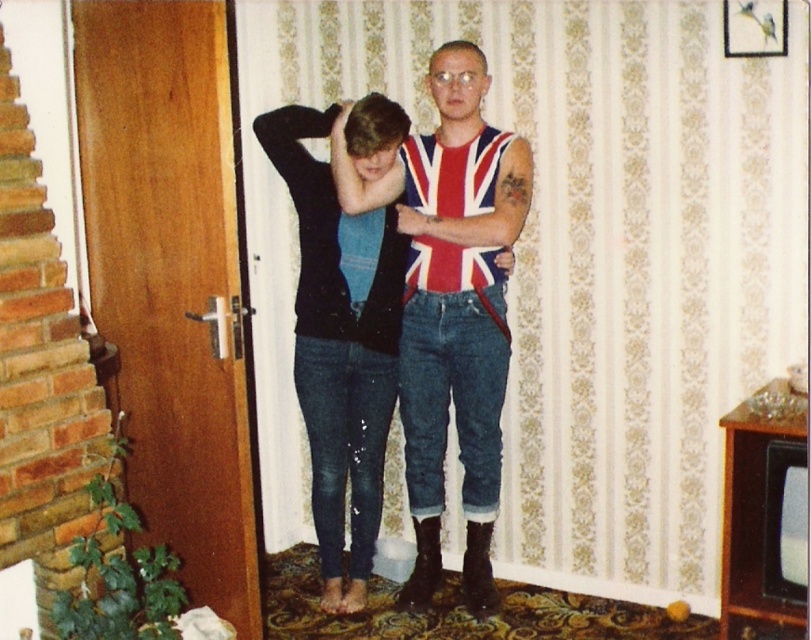
Does point (442, 252) come behind point (413, 524)?

No, (442, 252) is closer to viewer.

Does union jack fabric tank top at center have a lesser width compared to leather at lower center?

Incorrect, union jack fabric tank top at center's width is not less than leather at lower center's.

Measure the distance between point [445,214] and camera.

A distance of 3.02 meters exists between point [445,214] and camera.

Image resolution: width=811 pixels, height=640 pixels. I want to click on union jack fabric tank top at center, so click(x=457, y=316).

Between point (320, 195) and point (402, 604), which one is positioned behind?

The point (402, 604) is more distant.

Between black matte sweater at upper center and leather at lower center, which one is positioned lower?

leather at lower center

Is point (273, 147) farther from viewer compared to point (436, 572)?

No, (273, 147) is in front of (436, 572).

I want to click on black matte sweater at upper center, so click(x=298, y=150).

Is denim jeans at center above union jack fabric at center?

Incorrect, denim jeans at center is not positioned above union jack fabric at center.

Who is higher up, denim jeans at center or union jack fabric at center?

union jack fabric at center is higher up.

What do you see at coordinates (451, 396) in the screenshot?
I see `denim jeans at center` at bounding box center [451, 396].

Where is `denim jeans at center`? denim jeans at center is located at coordinates (451, 396).